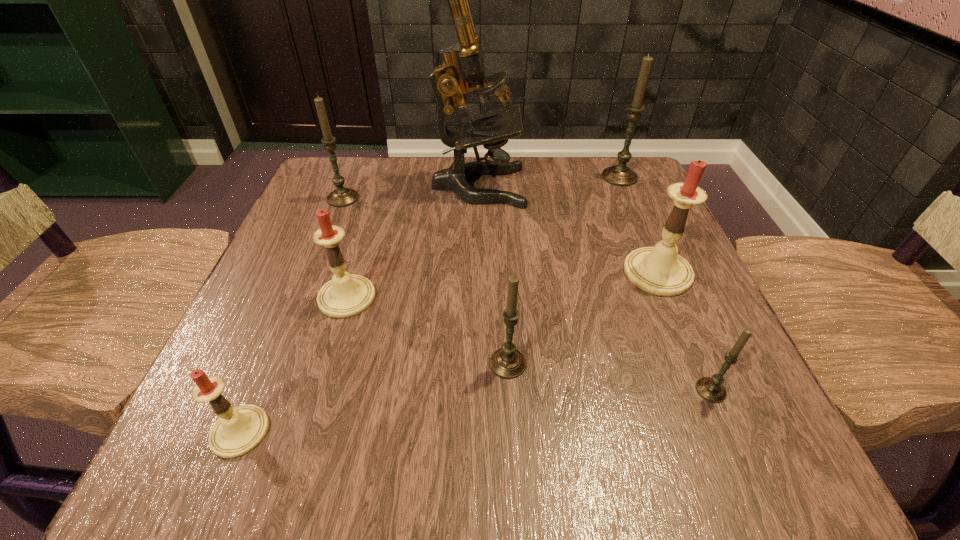
Find the location of a particular element. This screenshot has height=540, width=960. object that ranks as the fourth closest to the biggest red candle is located at coordinates (620, 175).

Where is `object that ranks as the second closest to the rightmost red candle`? object that ranks as the second closest to the rightmost red candle is located at coordinates coord(462,62).

Identify which candle is located as the sixth nearest to the rightmost red candle. Please provide its 2D coordinates. Your answer should be formatted as a tuple, i.e. [(x, y)], where the tuple contains the x and y coordinates of a point satisfying the conditions above.

[(239, 430)]

Where is `the second closest candle to the nearest candle`? The height and width of the screenshot is (540, 960). the second closest candle to the nearest candle is located at coordinates (507, 362).

Locate an element on the screen. the fourth closest gray candle to the second smallest red candle is located at coordinates (620, 175).

Identify which gray candle is the third nearest to the second farthest gray candle. Please provide its 2D coordinates. Your answer should be formatted as a tuple, i.e. [(x, y)], where the tuple contains the x and y coordinates of a point satisfying the conditions above.

[(712, 389)]

The height and width of the screenshot is (540, 960). I want to click on red candle that is the closest to the nearest object, so click(344, 296).

In order to click on red candle that can be found as the second closest to the smallest red candle in this screenshot , I will do `click(660, 270)`.

Locate an element on the screen. free point that satisfies the following two spatial constraints: 1. on the front side of the biggest gray candle; 2. on the right side of the smallest gray candle is located at coordinates coord(710,390).

I want to click on vacant area that satisfies the following two spatial constraints: 1. at the eyepieces of the microscope; 2. on the front side of the third smallest gray candle, so click(x=478, y=198).